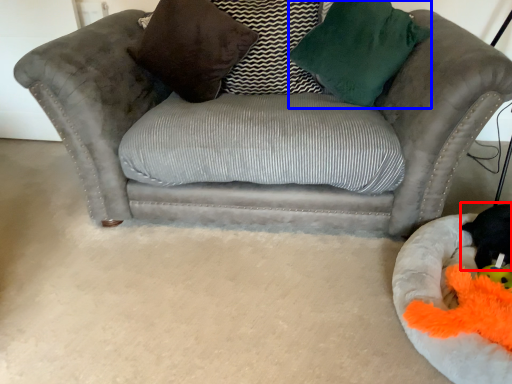
Question: Which object appears closest to the camera in this image, animal (highlighted by a red box) or throw pillow (highlighted by a blue box)?

Choices:
 (A) animal
 (B) throw pillow

Answer: (A)